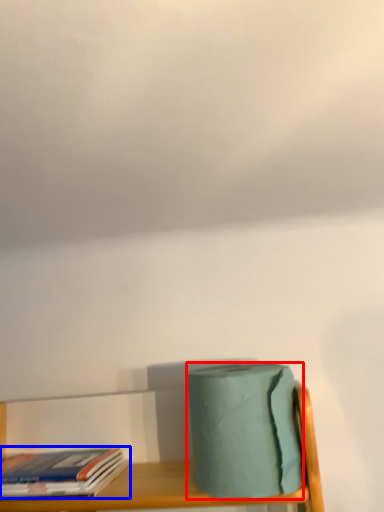
Question: Which object appears closest to the camera in this image, toilet paper (highlighted by a red box) or book (highlighted by a blue box)?

Choices:
 (A) toilet paper
 (B) book

Answer: (A)